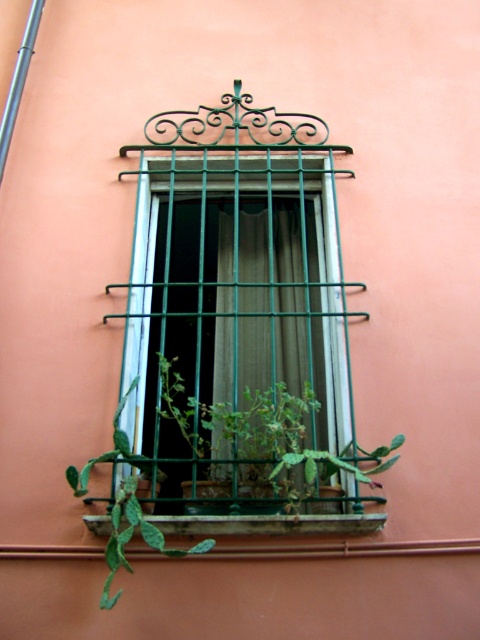
You are standing at the camera position and want to water the green spiky cactus at lower left. If your watering can has a maximum reach of 8 feet, will you be able to water it without moving closer?

The distance between the green spiky cactus at lower left and the camera is 9.09 feet, which is beyond the watering can reach of 8 feet. You need to move closer to water it.

You are standing in front of the window and want to move the green spiky cactus at lower left to the right side of the green sheer curtain at center. Is this possible without moving the curtain?

The green sheer curtain at center is already to the right of the green spiky cactus at lower left, so moving the cactus to the right of the curtain would require moving it past the curtain, which may not be possible without adjusting the curtain.